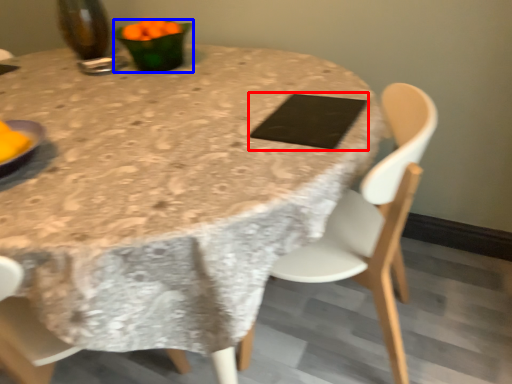
Question: Which object appears farthest to the camera in this image, pad (highlighted by a red box) or tableware (highlighted by a blue box)?

Choices:
 (A) pad
 (B) tableware

Answer: (B)